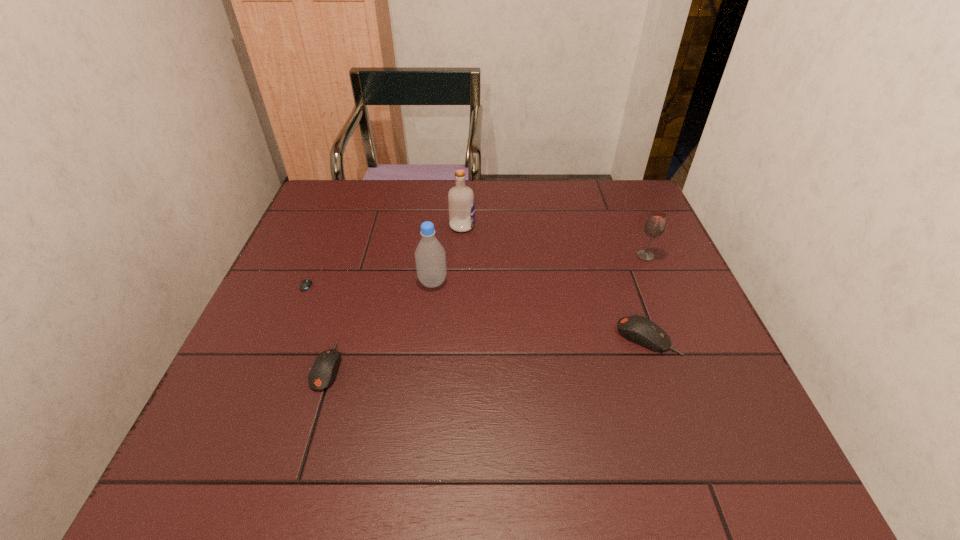
You are a GUI agent. You are given a task and a screenshot of the screen. Output one action in this format:
    pyautogui.click(x=<x>, y=<y>)
    Task: Click on the vacant space located on the right of the second shortest mouse
    The image size is (960, 540).
    Given the screenshot: What is the action you would take?
    pyautogui.click(x=453, y=366)

You are a GUI agent. You are given a task and a screenshot of the screen. Output one action in this format:
    pyautogui.click(x=<x>, y=<y>)
    Task: Click on the free space located on the back of the third shortest object
    The height and width of the screenshot is (540, 960).
    Given the screenshot: What is the action you would take?
    pyautogui.click(x=630, y=287)

The width and height of the screenshot is (960, 540). Identify the location of vacant space located on the front of the third tallest object. (661, 294).

Identify the location of free space located on the label of the vodka. The image size is (960, 540). (x=570, y=226).

Find the location of a particular element. The image size is (960, 540). vacant space located on the back of the bottle is located at coordinates (442, 200).

Find the location of `free space located on the front of the shortest mouse`. free space located on the front of the shortest mouse is located at coordinates (299, 309).

Where is `object situated at the far edge`? object situated at the far edge is located at coordinates (461, 205).

This screenshot has width=960, height=540. I want to click on object that is at the near edge, so click(x=323, y=371).

The height and width of the screenshot is (540, 960). Find the location of `object present at the left edge`. object present at the left edge is located at coordinates (305, 284).

This screenshot has height=540, width=960. Find the location of `computer mouse present at the right edge`. computer mouse present at the right edge is located at coordinates (638, 329).